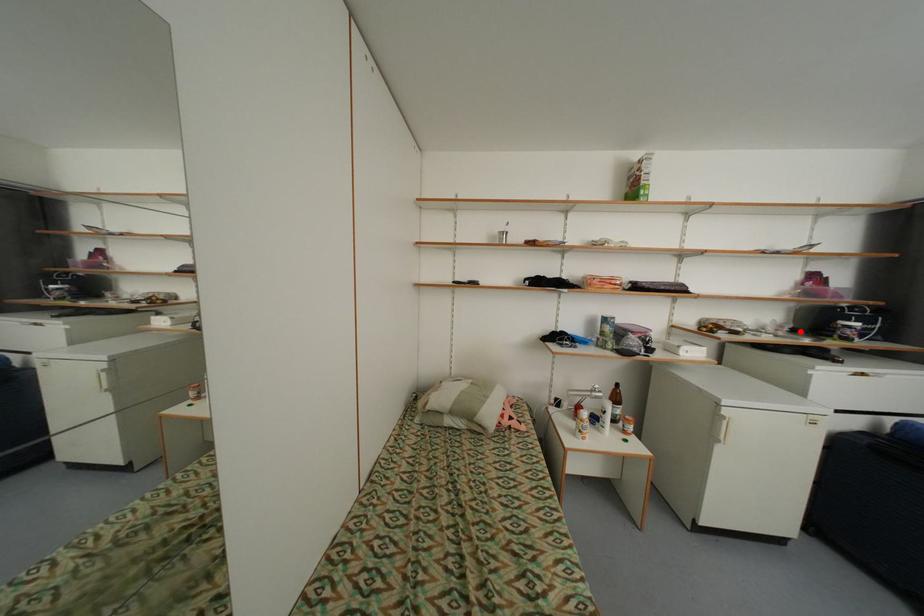
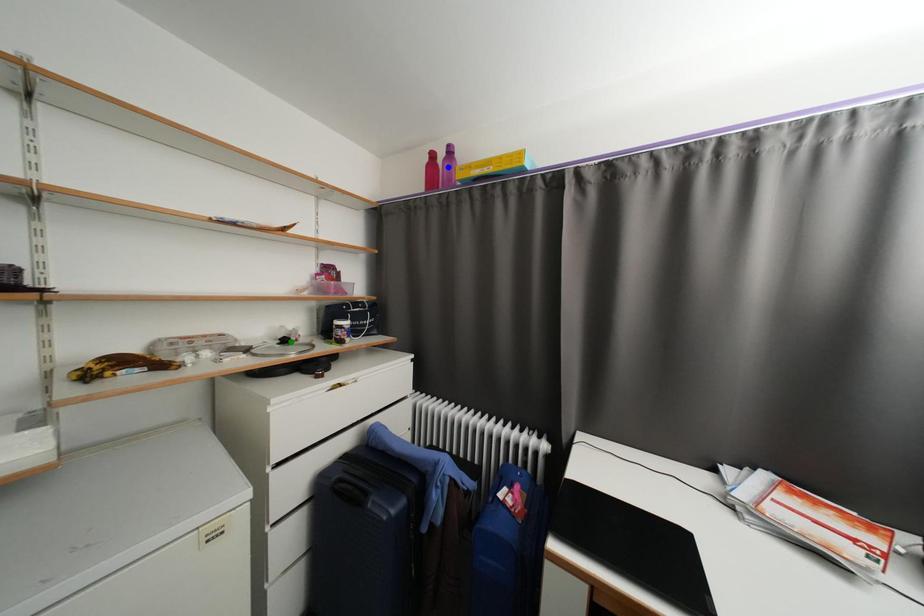
Question: I am providing you with two images of the same scene from different viewpoints. A red point is marked on the first image. You are given multiple points on the second image. Which point in image 2 represents the same 3d spot as the red point in image 1?

Choices:
 (A) yellow point
 (B) green point
 (C) blue point

Answer: (B)